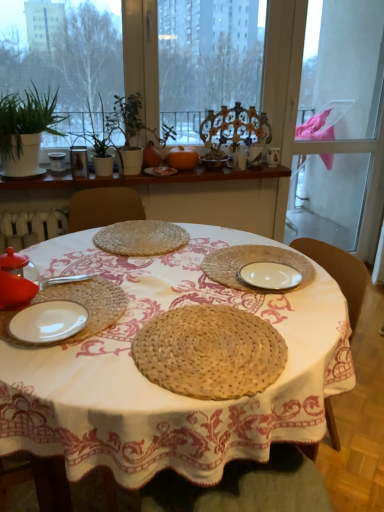
What are the coordinates of `vacant space in front of white matte plate at lower left, placed as the 5th plate when sorted from back to front` in the screenshot? It's located at coord(86,372).